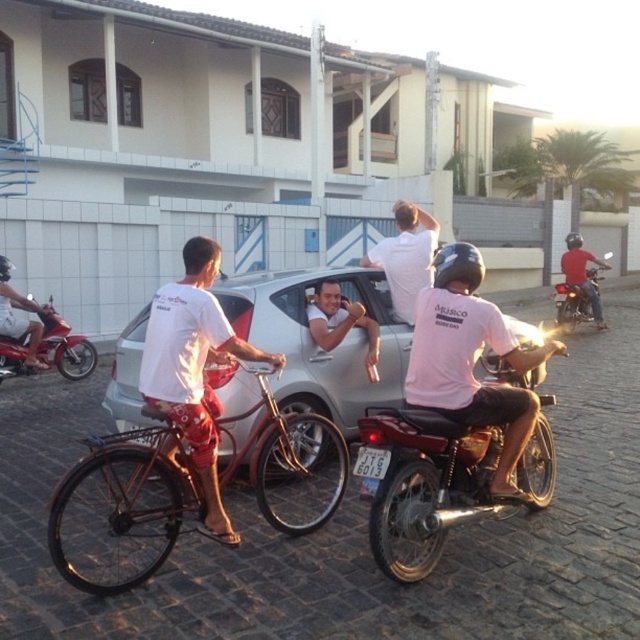
Can you confirm if shiny metallic bicycle at center is thinner than white matte shorts at center?

No.

Where is `shiny metallic bicycle at center`? shiny metallic bicycle at center is located at coordinates coord(128,497).

Locate an element on the screen. Image resolution: width=640 pixels, height=640 pixels. shiny metallic bicycle at center is located at coordinates (128, 497).

Where is `shiny metallic bicycle at center`? shiny metallic bicycle at center is located at coordinates 128,497.

Where is `shiny metallic motorcycle at center`? The height and width of the screenshot is (640, 640). shiny metallic motorcycle at center is located at coordinates (436, 481).

Is point (532, 486) behind point (186, 264)?

That is True.

Find the location of a particular element. shiny metallic motorcycle at center is located at coordinates (436, 481).

Where is `pink matte helmet at center`? This screenshot has height=640, width=640. pink matte helmet at center is located at coordinates (472, 360).

Is pink matte helmet at center bigger than brushed metal motorcycle at center-right?

Yes, pink matte helmet at center is bigger than brushed metal motorcycle at center-right.

Describe the element at coordinates (472, 360) in the screenshot. The width and height of the screenshot is (640, 640). I see `pink matte helmet at center` at that location.

Identify the location of pink matte helmet at center. The height and width of the screenshot is (640, 640). (472, 360).